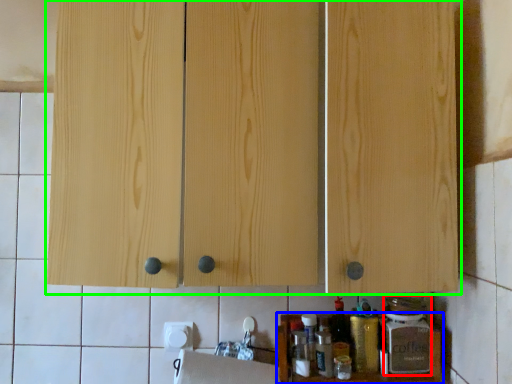
Question: Considering the real-world distances, which object is closest to bottle (highlighted by a red box)? cabinet (highlighted by a blue box) or cabinetry (highlighted by a green box).

Choices:
 (A) cabinet
 (B) cabinetry

Answer: (A)